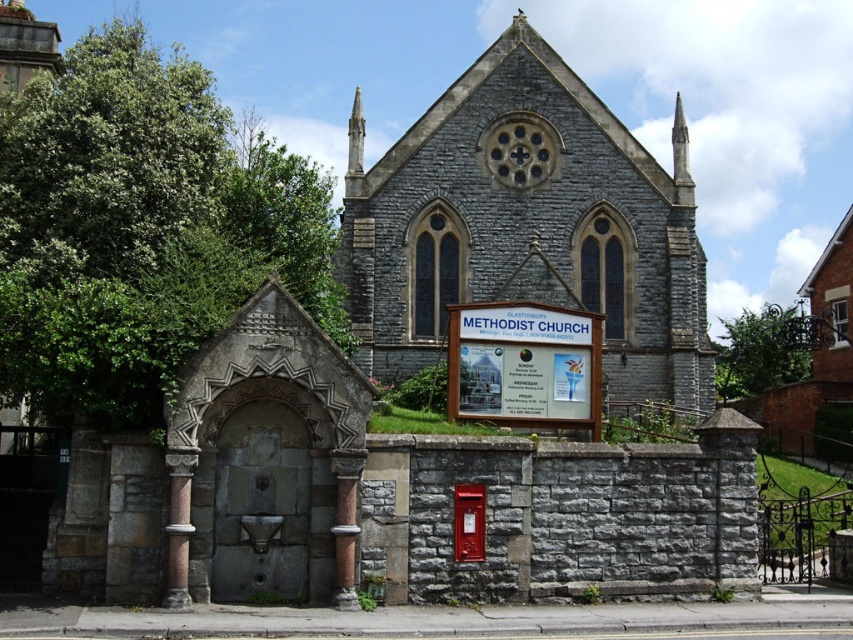
You are a visitor approaching the Glastonbury Methodist Church and want to take a photo of the gray stone chapel at center and the smooth stone spire at upper center. Which object should you focus on first if you want to capture both in a single frame without moving the camera?

You should focus on the gray stone chapel at center first since it is taller than the smooth stone spire at upper center, ensuring it fits within the frame when positioned properly.